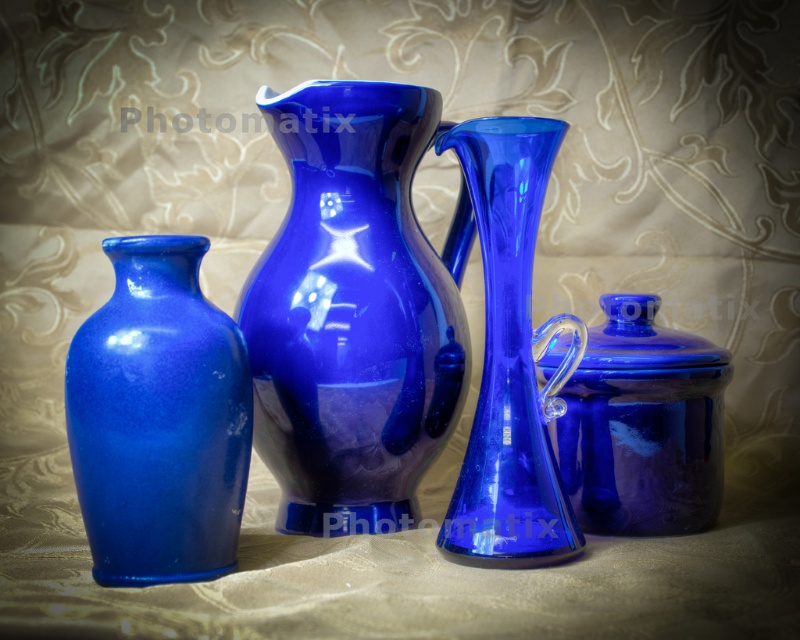
You are arranging flowers for a centerpiece and need to place a bouquet between the glossy ceramic jug at center and the glossy cobalt blue jar at right. The bouquet requires 9 inches of space. Will there be enough space between them to accommodate the bouquet?

The distance between the glossy ceramic jug at center and the glossy cobalt blue jar at right is 8.60 inches, which is slightly less than the required 9 inches. Therefore, there is not enough space to accommodate the bouquet between them.

You are arranging flowers for a centerpiece and need to choose between the glossy ceramic vase at left and the glossy cobalt blue jar at right. Which vessel has a smaller width to ensure it fits on a narrow table?

The glossy ceramic vase at left has a smaller width than the glossy cobalt blue jar at right, so it would fit better on a narrow table.